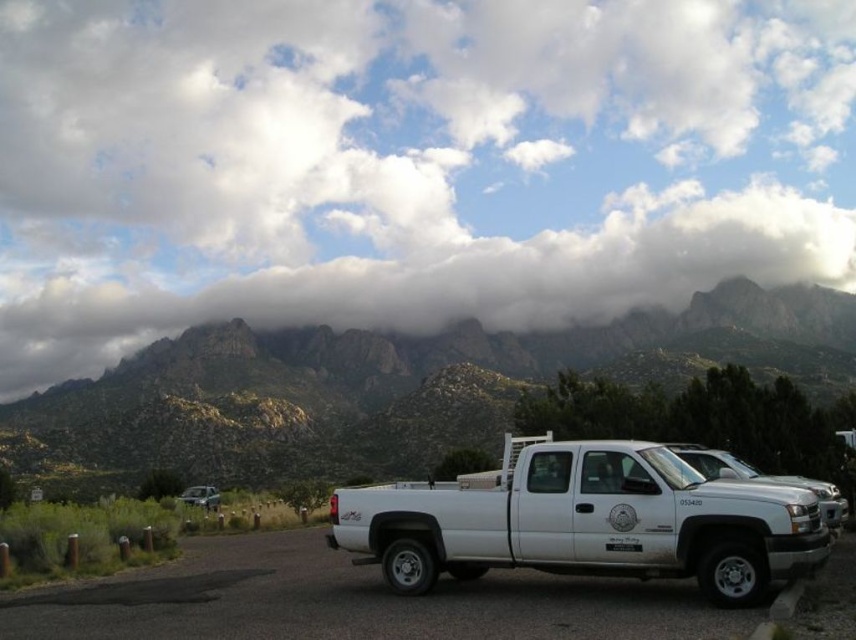
Question: Does white matte truck at center have a larger size compared to metallic silver suv at lower left?

Choices:
 (A) no
 (B) yes

Answer: (A)

Question: Which object is the farthest from the metallic silver suv at lower left?

Choices:
 (A) white fluffy cloud at upper center
 (B) white matte truck at center
 (C) rugged stone mountains at upper center

Answer: (A)

Question: Which of the following is the farthest from the observer?

Choices:
 (A) white fluffy cloud at upper center
 (B) rugged stone mountains at upper center
 (C) white matte truck at center
 (D) metallic silver suv at lower left

Answer: (A)

Question: Is rugged stone mountains at upper center bigger than white matte truck at center?

Choices:
 (A) yes
 (B) no

Answer: (A)

Question: Is white fluffy cloud at upper center to the left of metallic silver suv at lower left from the viewer's perspective?

Choices:
 (A) yes
 (B) no

Answer: (B)

Question: Which of the following is the closest to the observer?

Choices:
 (A) metallic silver suv at lower left
 (B) white matte truck at center
 (C) white fluffy cloud at upper center

Answer: (B)